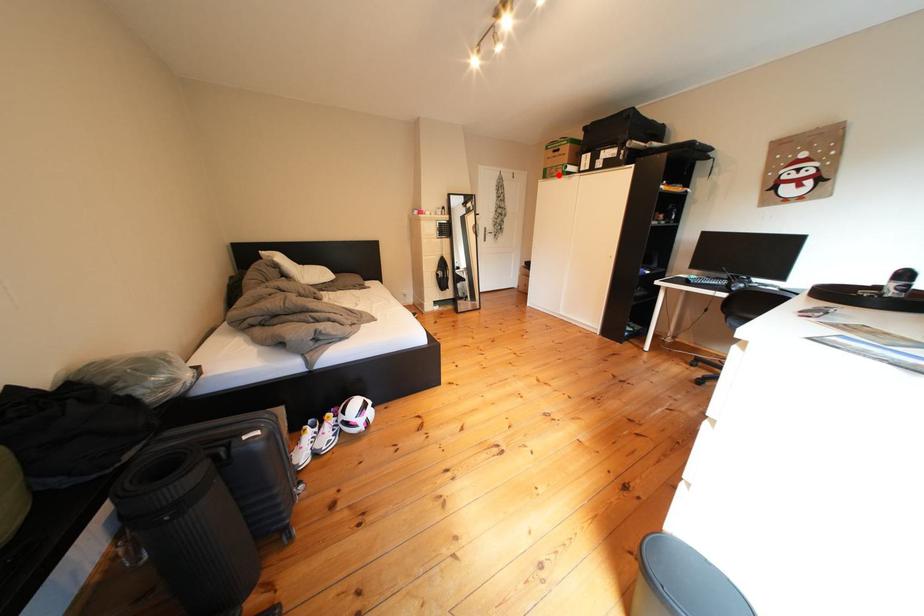
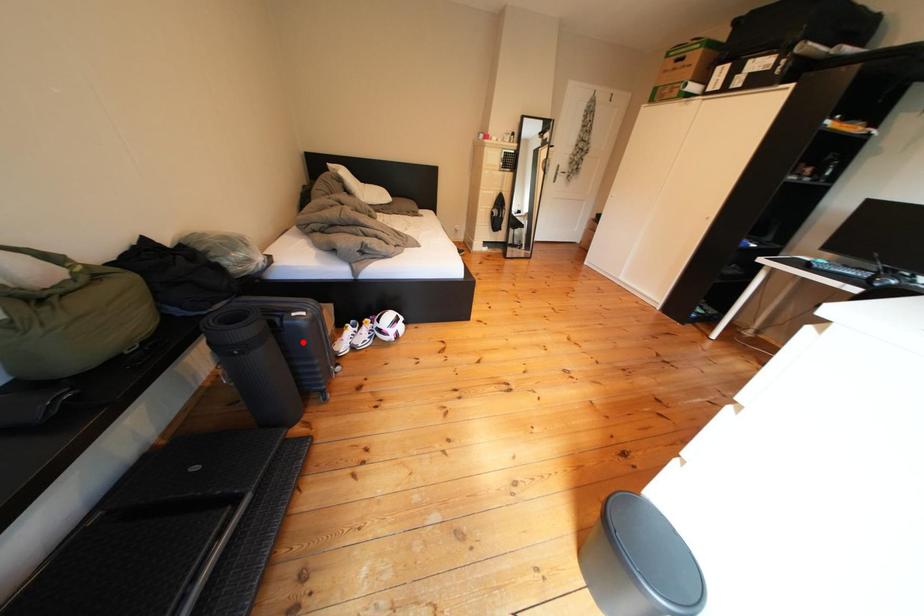
I am providing you with two images of the same scene from different viewpoints. A red point is marked on the first image and another point is marked on the second image. Is the red point in image1 aligned with the point shown in image2?

No